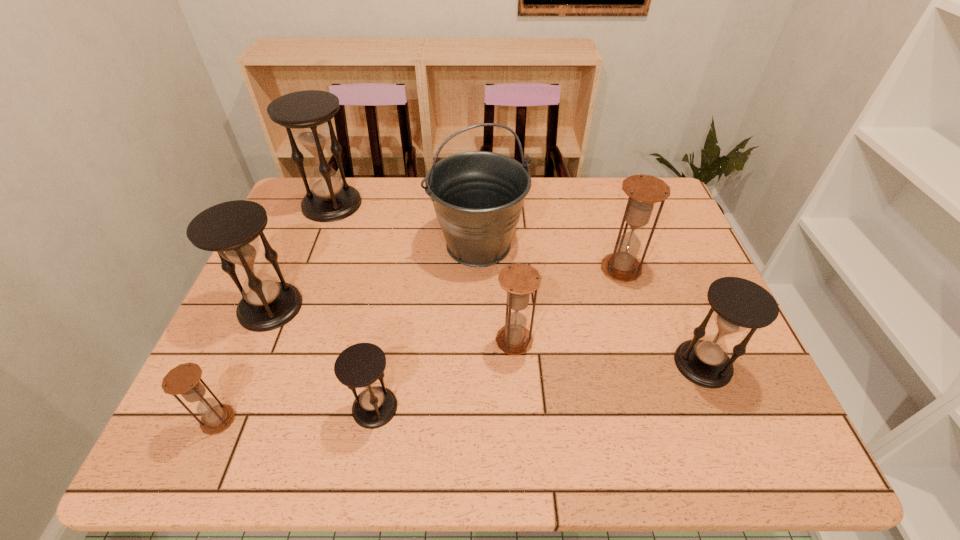
Identify the location of bucket. This screenshot has width=960, height=540. (478, 196).

Where is `the tallest hourglass`? This screenshot has width=960, height=540. the tallest hourglass is located at coordinates (329, 198).

At what (x,y) coordinates should I click in order to perform the action: click on the farthest black hourglass. Please return your answer as a coordinate pair (x, y). The image size is (960, 540). Looking at the image, I should click on (329, 198).

Image resolution: width=960 pixels, height=540 pixels. In order to click on the third smallest black hourglass in this screenshot , I will do (x=231, y=229).

The width and height of the screenshot is (960, 540). In order to click on the second object from right to left in this screenshot , I will do `click(644, 191)`.

Locate an element on the screen. the rightmost brown hourglass is located at coordinates (644, 191).

This screenshot has height=540, width=960. I want to click on the second nearest brown hourglass, so coord(520,280).

I want to click on the fifth hourglass from left to right, so click(520, 280).

Find the location of a particular element. This screenshot has width=960, height=540. the third biggest black hourglass is located at coordinates (738, 304).

This screenshot has height=540, width=960. I want to click on the rightmost object, so click(738, 304).